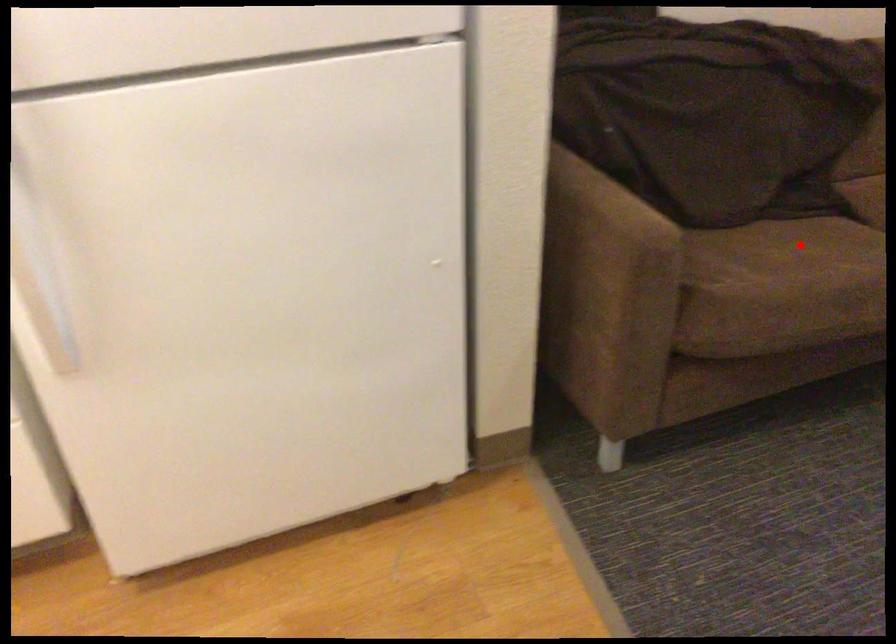
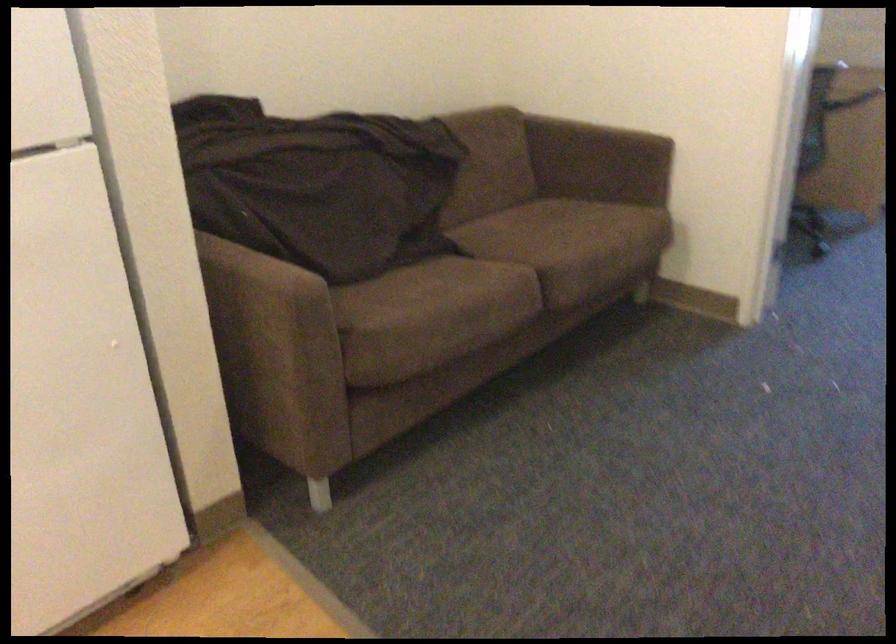
Question: I am providing you with two images of the same scene from different viewpoints. In image1, a red point is highlighted. Considering the same 3D point in image2, which of the following is correct?

Choices:
 (A) It is closer
 (B) It is farther

Answer: (B)